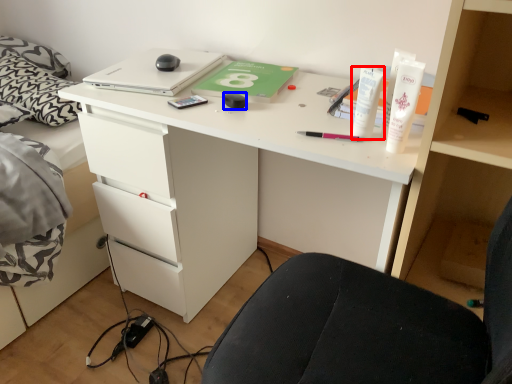
Question: Which object appears closest to the camera in this image, toiletry (highlighted by a red box) or stationery (highlighted by a blue box)?

Choices:
 (A) toiletry
 (B) stationery

Answer: (A)